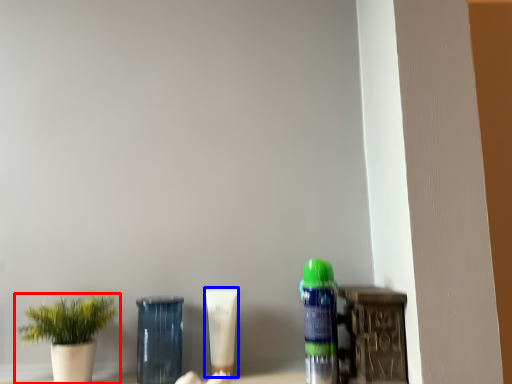
Question: Among these objects, which one is farthest to the camera, houseplant (highlighted by a red box) or product (highlighted by a blue box)?

Choices:
 (A) houseplant
 (B) product

Answer: (B)